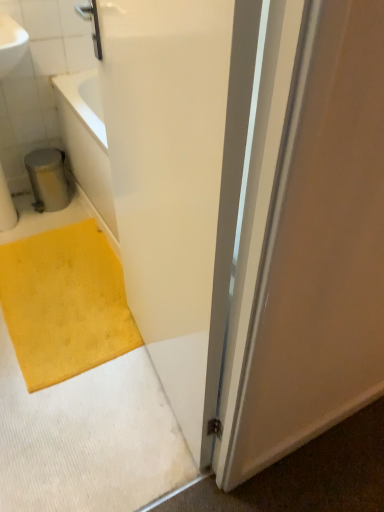
The image size is (384, 512). Find the location of `transparent plastic screen door at center`. transparent plastic screen door at center is located at coordinates (169, 179).

Image resolution: width=384 pixels, height=512 pixels. What do you see at coordinates (169, 179) in the screenshot? I see `transparent plastic screen door at center` at bounding box center [169, 179].

Where is `transparent plastic screen door at center`? This screenshot has height=512, width=384. transparent plastic screen door at center is located at coordinates (169, 179).